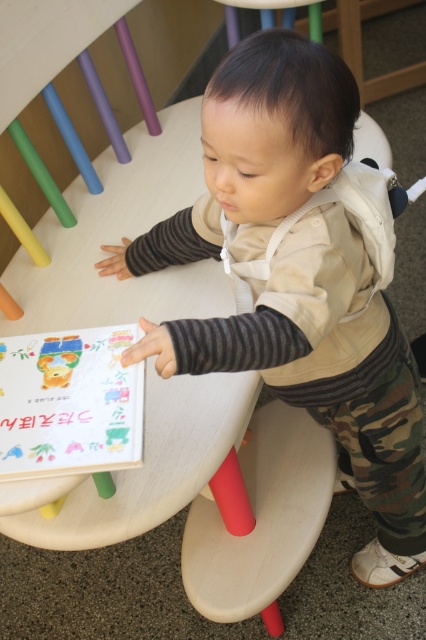
You are a photographer trying to capture a clear shot of both the camouflage pants at lower right and the matte plastic toy at lower left. Which object should you focus on first to ensure both are in focus?

You should focus on the camouflage pants at lower right first since it is closer to the viewer than the matte plastic toy at lower left. By focusing on the closer object, the depth of field may also keep the matte plastic toy at lower left in focus.

You are standing in front of the table with the children book. There are two points marked on the table surface. The first point is at coordinate point (x=253, y=336) and the second is at point (x=57, y=339). Which point is closer to you?

Point (x=253, y=336) is closer to the camera than point (x=57, y=339).

You are a parent setting up a play area for your child. You have a smooth wood stool at lower center and a matte plastic toy at lower left. Which object should you place closer to the edge of the table to prevent the child from knocking it over?

The smooth wood stool at lower center has a larger width than the matte plastic toy at lower left. Since the stool is wider, it should be placed closer to the edge of the table to prevent the child from knocking it over.